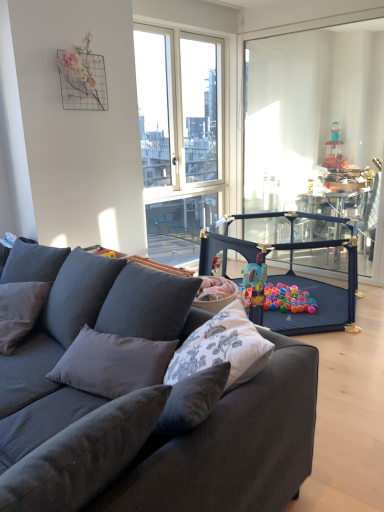
The height and width of the screenshot is (512, 384). Describe the element at coordinates (140, 402) in the screenshot. I see `dark gray fabric couch at center` at that location.

This screenshot has height=512, width=384. Identify the location of transparent plastic playpen at right. (316, 125).

Considering the relative sizes of transparent plastic playpen at right and dark gray fabric pillow at left in the image provided, is transparent plastic playpen at right taller than dark gray fabric pillow at left?

Correct, transparent plastic playpen at right is much taller as dark gray fabric pillow at left.

In the scene shown: How many degrees apart are the facing directions of transparent plastic playpen at right and dark gray fabric pillow at left?

The angle between the facing direction of transparent plastic playpen at right and the facing direction of dark gray fabric pillow at left is 17.8 degrees.

Where is `pillow to the left of transparent plastic playpen at right`? Image resolution: width=384 pixels, height=512 pixels. pillow to the left of transparent plastic playpen at right is located at coordinates (20, 311).

Is transparent plastic playpen at right beside dark gray fabric pillow at left?

There is a gap between transparent plastic playpen at right and dark gray fabric pillow at left.

From the image's perspective, is dark gray fabric pillow at left under dark gray fabric couch at center?

No.

From a real-world perspective, is dark gray fabric pillow at left positioned above or below dark gray fabric couch at center?

From a real-world perspective, dark gray fabric pillow at left is physically above dark gray fabric couch at center.

Does dark gray fabric pillow at left appear on the left side of dark gray fabric couch at center?

Yes.

How distant is dark gray fabric pillow at left from dark gray fabric couch at center?

A distance of 10.00 inches exists between dark gray fabric pillow at left and dark gray fabric couch at center.

Looking at the image, does dark gray fabric pillow at left seem bigger or smaller compared to dark gray fabric playpen at center?

dark gray fabric pillow at left is smaller than dark gray fabric playpen at center.

From a real-world perspective, relative to dark gray fabric playpen at center, is dark gray fabric pillow at left vertically above or below?

dark gray fabric pillow at left is situated higher than dark gray fabric playpen at center in the real world.

How distant is dark gray fabric pillow at left from dark gray fabric playpen at center?

dark gray fabric pillow at left and dark gray fabric playpen at center are 1.56 meters apart from each other.

Can you confirm if dark gray fabric pillow at left is thinner than dark gray fabric playpen at center?

Yes, dark gray fabric pillow at left is thinner than dark gray fabric playpen at center.

Image resolution: width=384 pixels, height=512 pixels. In order to click on armchair behind the dark gray fabric pillow at left in this screenshot , I will do `click(289, 275)`.

Which point is more forward, (298,215) or (1,292)?

The point (1,292) is closer to the camera.

Is dark gray fabric pillow at left inside dark gray fabric playpen at center?

No, dark gray fabric pillow at left is not a part of dark gray fabric playpen at center.

How distant is dark gray fabric playpen at center from dark gray fabric pillow at left?

dark gray fabric playpen at center is 5.11 feet away from dark gray fabric pillow at left.

Based on the photo, is there a large distance between dark gray fabric couch at center and dark gray fabric pillow at left?

No, there isn't a large distance between dark gray fabric couch at center and dark gray fabric pillow at left.

Can you tell me how much dark gray fabric couch at center and dark gray fabric pillow at left differ in facing direction?

They differ by 20.5 degrees in their facing directions.

Measure the distance between dark gray fabric couch at center and dark gray fabric pillow at left.

They are 10.00 inches apart.

Between dark gray fabric couch at center and dark gray fabric pillow at left, which one appears on the right side from the viewer's perspective?

From the viewer's perspective, dark gray fabric couch at center appears more on the right side.

Find the location of `screen door behind the dark gray fabric couch at center`. screen door behind the dark gray fabric couch at center is located at coordinates (316, 125).

Is transparent plastic playpen at right in front of or behind dark gray fabric couch at center in the image?

transparent plastic playpen at right is positioned farther from the viewer than dark gray fabric couch at center.

Looking at this image, is transparent plastic playpen at right directly adjacent to dark gray fabric couch at center?

transparent plastic playpen at right and dark gray fabric couch at center are clearly separated.

From a real-world perspective, which object rests below the other?

dark gray fabric couch at center is physically lower.

Can you confirm if dark gray fabric couch at center is smaller than dark gray fabric playpen at center?

No.

Is dark gray fabric couch at center with dark gray fabric playpen at center?

There is a gap between dark gray fabric couch at center and dark gray fabric playpen at center.

Based on the photo, can you confirm if dark gray fabric couch at center is shorter than dark gray fabric playpen at center?

No.

Considering the sizes of objects dark gray fabric couch at center and dark gray fabric playpen at center in the image provided, who is wider, dark gray fabric couch at center or dark gray fabric playpen at center?

dark gray fabric playpen at center is wider.

Locate an element on the screen. The width and height of the screenshot is (384, 512). screen door behind the dark gray fabric pillow at left is located at coordinates (316, 125).

The height and width of the screenshot is (512, 384). In order to click on studio couch on the right of dark gray fabric pillow at left in this screenshot , I will do `click(140, 402)`.

Which object lies nearer to the anchor point dark gray fabric pillow at left, dark gray fabric playpen at center or dark gray fabric couch at center?

The object closer to dark gray fabric pillow at left is dark gray fabric couch at center.

In the scene shown: Which object lies nearer to the anchor point dark gray fabric pillow at left, dark gray fabric couch at center or dark gray fabric playpen at center?

dark gray fabric couch at center.

Which object lies nearer to the anchor point dark gray fabric pillow at left, dark gray fabric couch at center or transparent plastic playpen at right?

dark gray fabric couch at center.

Which object lies further to the anchor point dark gray fabric couch at center, dark gray fabric playpen at center or dark gray fabric pillow at left?

Among the two, dark gray fabric playpen at center is located further to dark gray fabric couch at center.

Considering their positions, is dark gray fabric playpen at center positioned further to dark gray fabric pillow at left than transparent plastic playpen at right?

Based on the image, transparent plastic playpen at right appears to be further to dark gray fabric pillow at left.

Based on their spatial positions, is transparent plastic playpen at right or dark gray fabric couch at center further from dark gray fabric playpen at center?

Based on the image, dark gray fabric couch at center appears to be further to dark gray fabric playpen at center.

Considering their positions, is dark gray fabric playpen at center positioned closer to transparent plastic playpen at right than dark gray fabric pillow at left?

dark gray fabric playpen at center lies closer to transparent plastic playpen at right than the other object.

Based on the photo, from the image, which object appears to be farther from dark gray fabric playpen at center, dark gray fabric couch at center or dark gray fabric pillow at left?

Based on the image, dark gray fabric pillow at left appears to be further to dark gray fabric playpen at center.

In order to click on armchair between dark gray fabric pillow at left and transparent plastic playpen at right from left to right in this screenshot , I will do point(289,275).

Where is `armchair between dark gray fabric couch at center and transparent plastic playpen at right in the front-back direction`? armchair between dark gray fabric couch at center and transparent plastic playpen at right in the front-back direction is located at coordinates (289, 275).

This screenshot has width=384, height=512. Find the location of `pillow between dark gray fabric couch at center and transparent plastic playpen at right along the z-axis`. pillow between dark gray fabric couch at center and transparent plastic playpen at right along the z-axis is located at coordinates (20, 311).

Image resolution: width=384 pixels, height=512 pixels. Identify the location of pillow located between dark gray fabric couch at center and dark gray fabric playpen at center in the depth direction. (20, 311).